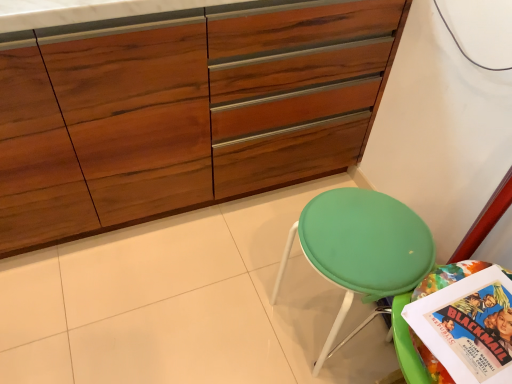
This screenshot has height=384, width=512. What are the coordinates of `vacant space situated on the left part of green fabric stool at lower right` in the screenshot? It's located at (239, 307).